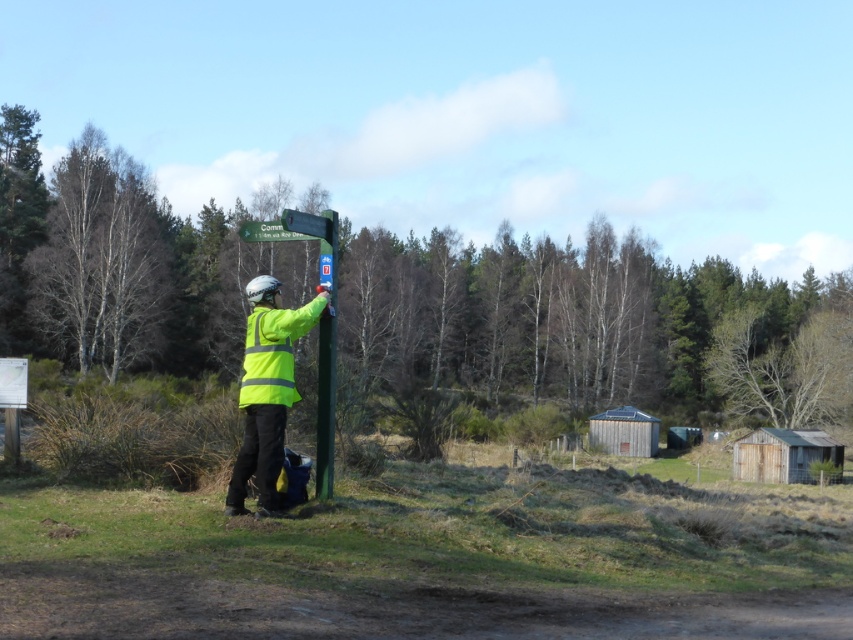
Is green leafy tree at center in front of bare wood tree at left?

Yes, green leafy tree at center is closer to the viewer.

Who is higher up, green leafy tree at center or bare wood tree at left?

bare wood tree at left is above.

Between point (16, 324) and point (105, 307), which one is positioned in front?

Point (105, 307)

You are a GUI agent. You are given a task and a screenshot of the screen. Output one action in this format:
    pyautogui.click(x=<x>, y=<y>)
    Task: Click on the green leafy tree at center
    Image resolution: width=853 pixels, height=640 pixels.
    Given the screenshot: What is the action you would take?
    pyautogui.click(x=556, y=316)

Who is positioned more to the right, bare wood tree at left or green plastic sign at upper center?

green plastic sign at upper center

Describe the element at coordinates (102, 259) in the screenshot. Image resolution: width=853 pixels, height=640 pixels. I see `bare wood tree at left` at that location.

Describe the element at coordinates (102, 259) in the screenshot. I see `bare wood tree at left` at that location.

You are a GUI agent. You are given a task and a screenshot of the screen. Output one action in this format:
    pyautogui.click(x=<x>, y=<y>)
    Task: Click on the bare wood tree at left
    
    Given the screenshot: What is the action you would take?
    pyautogui.click(x=102, y=259)

Is point (323, 472) behind point (274, 230)?

That is False.

Does point (323, 317) lie in front of point (294, 225)?

No, (323, 317) is further to viewer.

Is point (328, 470) behind point (323, 227)?

No, (328, 470) is in front of (323, 227).

Where is `green painted wood at center`? This screenshot has height=640, width=853. green painted wood at center is located at coordinates (326, 355).